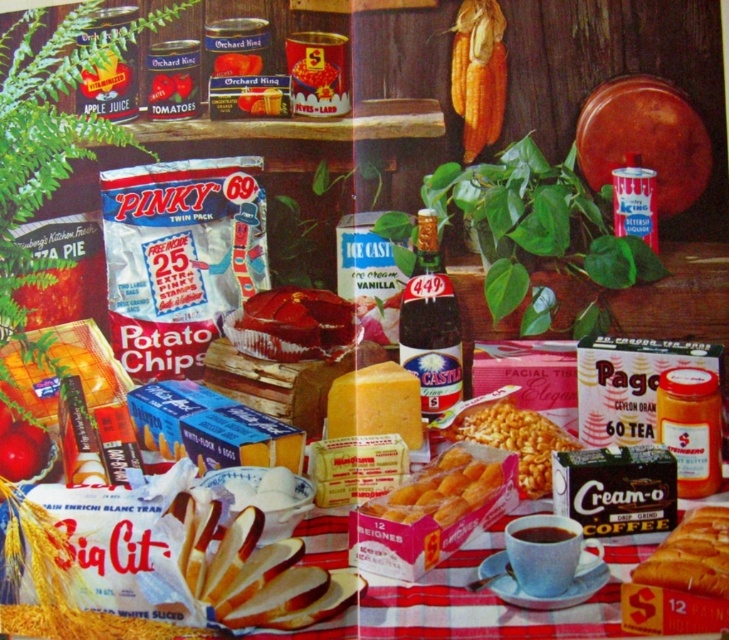
Question: Is sliced white bread at center bigger than dark brown cardboard coffee at lower right?

Choices:
 (A) no
 (B) yes

Answer: (B)

Question: Which of the following is the closest to the observer?

Choices:
 (A) dark brown cardboard coffee at lower right
 (B) matte yellow macaroni at center
 (C) golden fried pastry at center
 (D) brown glass bottle at center

Answer: (A)

Question: Which of the following is the closest to the observer?

Choices:
 (A) (674, 538)
 (B) (545, 493)
 (C) (276, 324)
 (D) (35, 445)

Answer: (A)

Question: Is brown glass bottle at center to the left of matte yellow macaroni at center from the viewer's perspective?

Choices:
 (A) yes
 (B) no

Answer: (A)

Question: Is shiny red jelly at center in front of golden fried pastry at center?

Choices:
 (A) no
 (B) yes

Answer: (A)

Question: Which object is the closest to the dark brown cardboard coffee at lower right?

Choices:
 (A) matte yellow macaroni at center
 (B) shiny red jelly at center

Answer: (A)